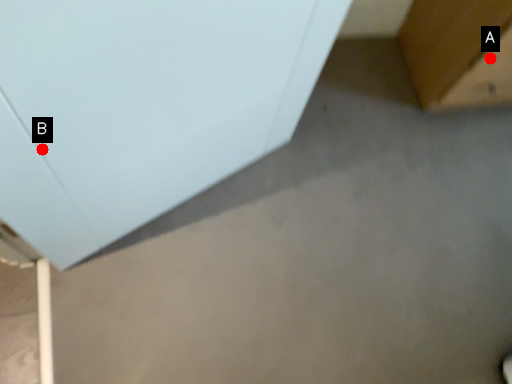
Question: Two points are circled on the image, labeled by A and B beside each circle. Which point is closer to the camera taking this photo?

Choices:
 (A) A is closer
 (B) B is closer

Answer: (B)